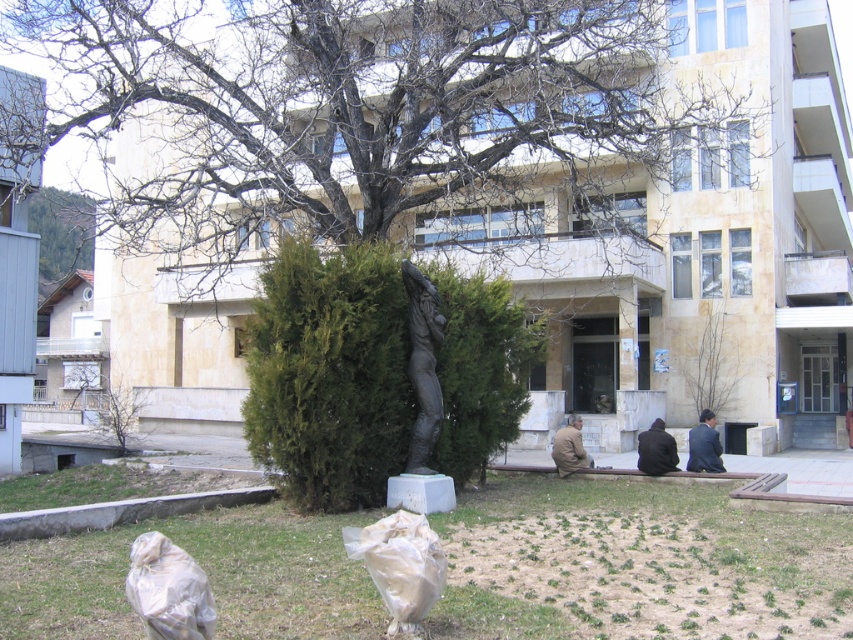
Is point (664, 145) more distant than point (416, 452)?

Yes, point (664, 145) is behind point (416, 452).

Which is more to the right, bare branches at center or black polished statue at center?

Positioned to the right is black polished statue at center.

Is point (196, 88) positioned in front of point (424, 298)?

No, (196, 88) is behind (424, 298).

In order to click on bare branches at center in this screenshot , I will do `click(357, 104)`.

Is bare branches at center smaller than green grass at lower center?

Incorrect, bare branches at center is not smaller in size than green grass at lower center.

Is point (408, 172) farther from camera compared to point (494, 564)?

Yes, point (408, 172) is farther from viewer.

This screenshot has height=640, width=853. I want to click on bare branches at center, so 357,104.

Is white plastic bag at lower center behind transparent plastic bag at lower left?

Yes.

Is white plastic bag at lower center wider than transparent plastic bag at lower left?

Indeed, white plastic bag at lower center has a greater width compared to transparent plastic bag at lower left.

Who is more distant from viewer, (x=440, y=572) or (x=184, y=572)?

Point (x=440, y=572)

Find the location of a particular element. white plastic bag at lower center is located at coordinates (399, 564).